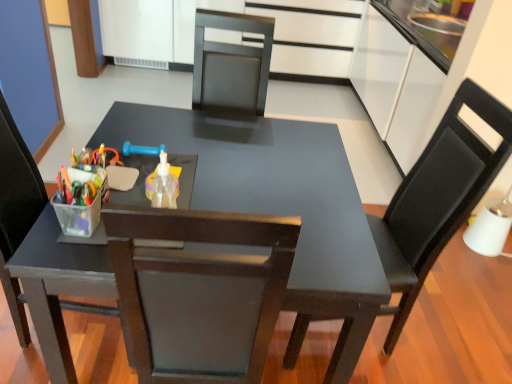
What are the coordinates of `vacant area that lies to the right of translucent plastic bottle at center` in the screenshot? It's located at (229, 199).